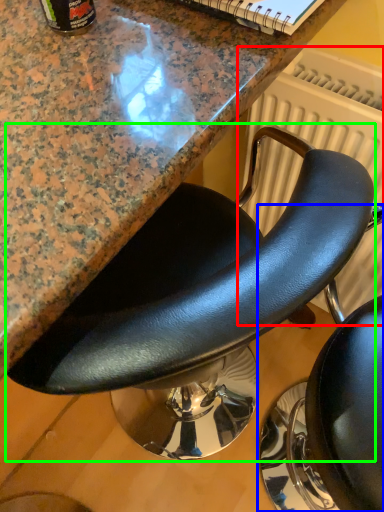
Question: Based on their relative distances, which object is nearer to radiator (highlighted by a red box)? Choose from chair (highlighted by a blue box) and chair (highlighted by a green box).

Choices:
 (A) chair
 (B) chair

Answer: (B)